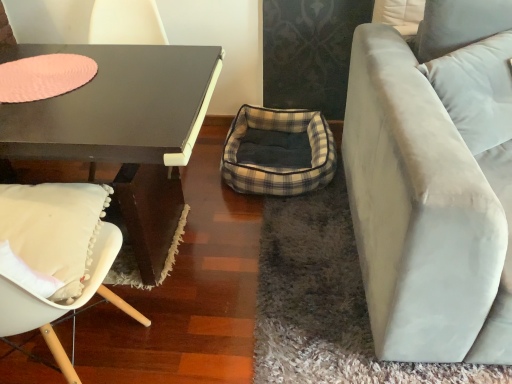
Question: From their relative heights in the image, would you say plaid fabric bean bag at center is taller or shorter than matte black coffee table at left?

Choices:
 (A) tall
 (B) short

Answer: (B)

Question: Looking at their shapes, would you say plaid fabric bean bag at center is wider or thinner than matte black coffee table at left?

Choices:
 (A) wide
 (B) thin

Answer: (B)

Question: Which of these objects is positioned farthest from the white fabric chair at left?

Choices:
 (A) matte black coffee table at left
 (B) matte black table at left
 (C) pink felt placemat at upper left
 (D) plaid fabric bean bag at center
 (E) light beige fabric couch at right

Answer: (D)

Question: Estimate the real-world distances between objects in this image. Which object is farther from the plaid fabric bean bag at center?

Choices:
 (A) light beige fabric couch at right
 (B) matte black coffee table at left
 (C) pink felt placemat at upper left
 (D) white fabric chair at left
 (E) white fabric pillow at upper right

Answer: (D)